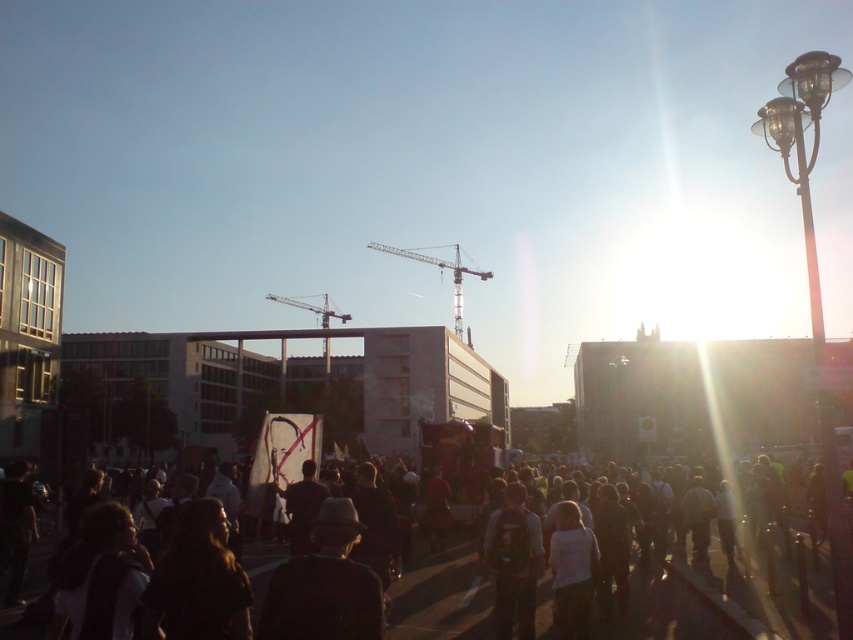
Between white matte shirt at center and metallic gray crane at center, which one appears on the right side from the viewer's perspective?

white matte shirt at center

Does point (576, 592) lie in front of point (285, 298)?

That is True.

The width and height of the screenshot is (853, 640). In order to click on white matte shirt at center in this screenshot , I will do `click(572, 570)`.

From the picture: Between dark brown leather hat at center and white matte shirt at center, which one appears on the right side from the viewer's perspective?

white matte shirt at center is more to the right.

Describe the element at coordinates (325, 586) in the screenshot. This screenshot has width=853, height=640. I see `dark brown leather hat at center` at that location.

Where is `dark brown leather hat at center`? The width and height of the screenshot is (853, 640). dark brown leather hat at center is located at coordinates (325, 586).

Does dark brown leather hat at center lie behind metallic gray crane at center?

That is False.

Identify the location of dark brown leather hat at center. This screenshot has width=853, height=640. (325, 586).

At what (x,y) coordinates should I click in order to perform the action: click on dark brown leather hat at center. Please return your answer as a coordinate pair (x, y). Looking at the image, I should click on (325, 586).